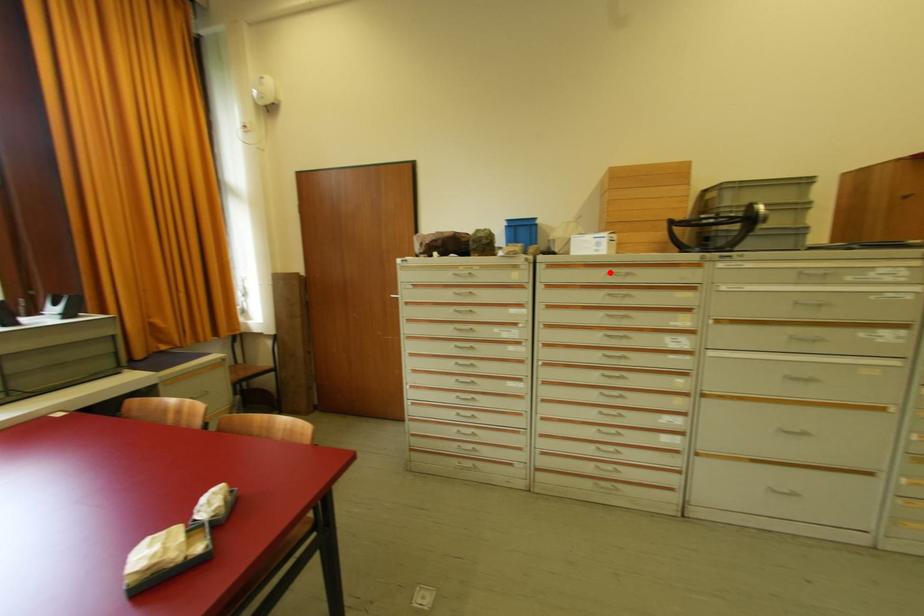
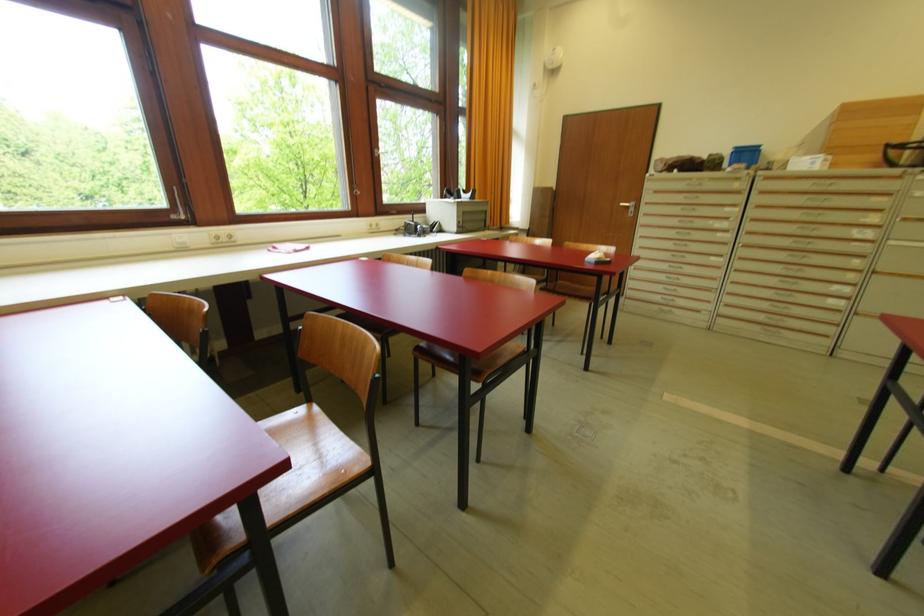
Question: I am providing you with two images of the same scene from different viewpoints. A red point is shown in image1. For the corresponding object point in image2, is it positioned nearer or farther from the camera?

Choices:
 (A) Nearer
 (B) Farther

Answer: (B)